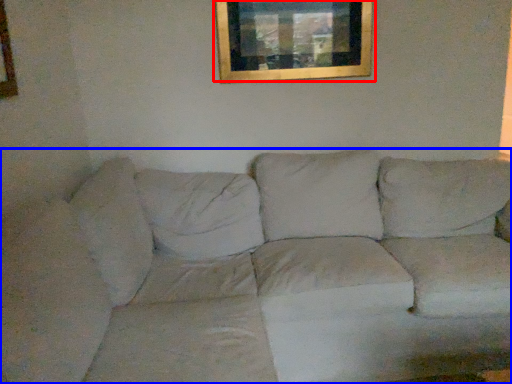
Question: Which point is closer to the camera, picture frame (highlighted by a red box) or studio couch (highlighted by a blue box)?

Choices:
 (A) picture frame
 (B) studio couch

Answer: (B)